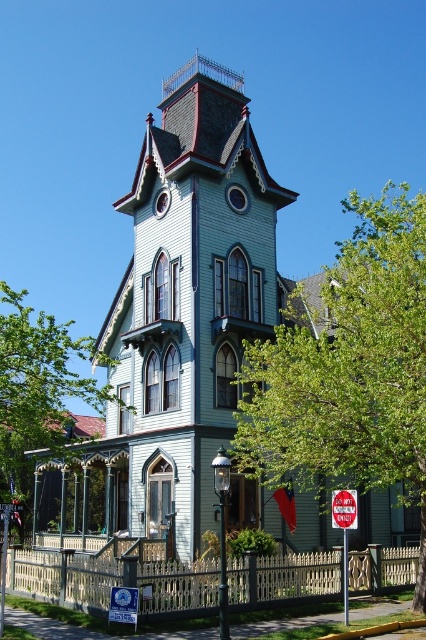
Which of these two, green leafy tree at lower right or green leafy tree at center, stands shorter?

green leafy tree at center is shorter.

Who is more distant from viewer, [253,440] or [34,358]?

The point [34,358] is behind.

Where is `green leafy tree at lower right`? The image size is (426, 640). green leafy tree at lower right is located at coordinates (350, 371).

Does point (351, 324) come in front of point (350, 520)?

No, it is not.

Between point (393, 397) and point (351, 516), which one is positioned in front?

Point (393, 397)

Where is `green leafy tree at lower right`? This screenshot has height=640, width=426. green leafy tree at lower right is located at coordinates pyautogui.click(x=350, y=371).

Is point (2, 324) farther from camera compared to point (342, 506)?

Yes, it is.

Does green leafy tree at center have a greater height compared to red metal stop sign at center?

Correct, green leafy tree at center is much taller as red metal stop sign at center.

Locate an element on the screen. green leafy tree at center is located at coordinates (37, 387).